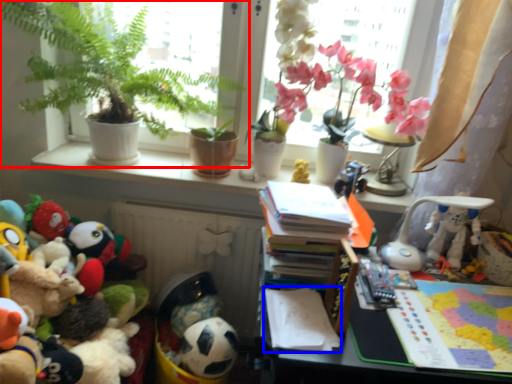
Question: Which object is closer to the camera taking this photo, houseplant (highlighted by a red box) or notepad (highlighted by a blue box)?

Choices:
 (A) houseplant
 (B) notepad

Answer: (B)